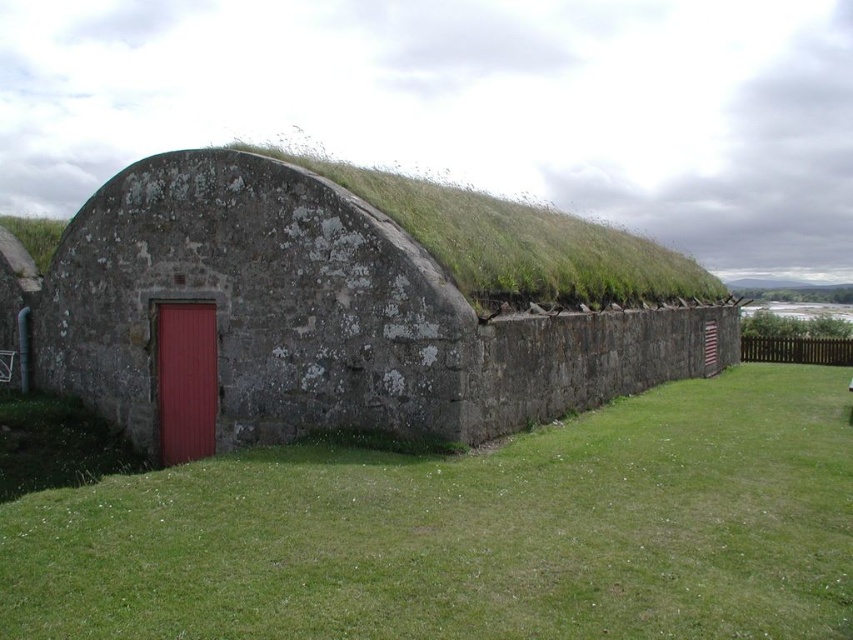
You are standing in front of the rustic stone hut at center and want to place a small garden of green grass at center in front of it. Based on the height of the grass and the hut, will the grass be visible from the front of the hut?

The green grass at center has a lesser height compared to rustic stone hut at center, so yes, the grass will be visible from the front of the rustic stone hut at center since it is shorter than the hut.